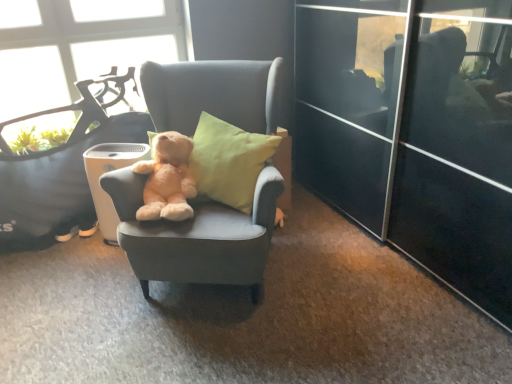
Question: Can you confirm if soft beige teddy bear at center is bigger than soft gray fabric chair at center, which ranks as the second chair in right-to-left order?

Choices:
 (A) yes
 (B) no

Answer: (B)

Question: From a real-world perspective, is soft beige teddy bear at center on top of soft gray fabric chair at center, which ranks as the second chair in right-to-left order?

Choices:
 (A) no
 (B) yes

Answer: (B)

Question: Is soft beige teddy bear at center further to camera compared to soft gray fabric chair at center, which ranks as the second chair in right-to-left order?

Choices:
 (A) no
 (B) yes

Answer: (A)

Question: Can you confirm if soft beige teddy bear at center is smaller than soft gray fabric chair at center, the first chair when ordered from left to right?

Choices:
 (A) yes
 (B) no

Answer: (A)

Question: Is soft beige teddy bear at center facing away from soft gray fabric chair at center, which ranks as the second chair in right-to-left order?

Choices:
 (A) no
 (B) yes

Answer: (B)

Question: Considering their positions, is white plastic trash bin/can at center located in front of or behind soft gray fabric chair at center, which ranks as the second chair in right-to-left order?

Choices:
 (A) behind
 (B) front

Answer: (A)

Question: From a real-world perspective, is white plastic trash bin/can at center physically located above or below soft gray fabric chair at center, which ranks as the second chair in right-to-left order?

Choices:
 (A) above
 (B) below

Answer: (B)

Question: Considering the positions of point (94, 187) and point (123, 137), is point (94, 187) closer or farther from the camera than point (123, 137)?

Choices:
 (A) closer
 (B) farther

Answer: (A)

Question: From their relative heights in the image, would you say white plastic trash bin/can at center is taller or shorter than soft gray fabric chair at center, which ranks as the second chair in right-to-left order?

Choices:
 (A) short
 (B) tall

Answer: (A)

Question: Is point (264, 183) positioned closer to the camera than point (141, 213)?

Choices:
 (A) farther
 (B) closer

Answer: (B)

Question: From the image's perspective, is soft gray fabric chair at center, which ranks as the second chair in left-to-right order, located above or below soft beige teddy bear at center?

Choices:
 (A) below
 (B) above

Answer: (A)

Question: In the image, is soft gray fabric chair at center, which ranks as the second chair in left-to-right order, positioned in front of or behind soft beige teddy bear at center?

Choices:
 (A) front
 (B) behind

Answer: (A)

Question: Choose the correct answer: Is soft gray fabric chair at center, the first chair when ordered from right to left, inside soft beige teddy bear at center or outside it?

Choices:
 (A) inside
 (B) outside

Answer: (B)

Question: In terms of size, does soft beige teddy bear at center appear bigger or smaller than soft gray fabric chair at center, the first chair when ordered from left to right?

Choices:
 (A) small
 (B) big

Answer: (A)

Question: Is soft beige teddy bear at center wider or thinner than soft gray fabric chair at center, which ranks as the second chair in right-to-left order?

Choices:
 (A) thin
 (B) wide

Answer: (B)